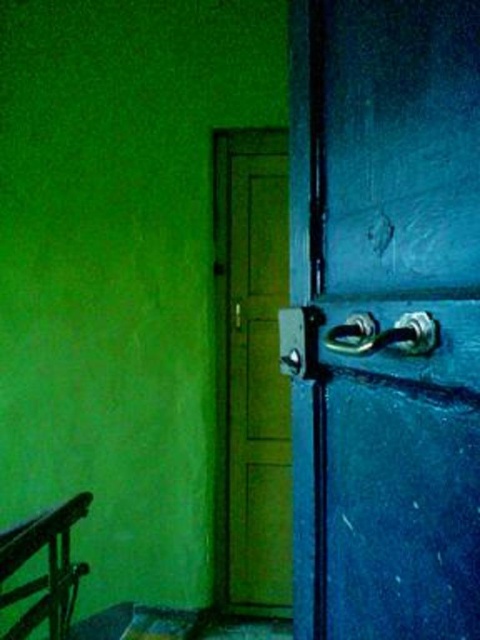
You are an interior designer assessing the door and balustrade. Which object has a greater width between the blue matte door handle at center and the brushed metal balustrade at lower left?

The blue matte door handle at center has a greater width than the brushed metal balustrade at lower left.

You are standing in a room with a green matte door at center. You want to open the door but need to know if you can reach it from your current position. The average person is about 5.5 feet tall. Can you reach the door handle if it is placed at the standard height of 42 inches?

The green matte door at center is 10.96 feet away from you, which is approximately 131.5 inches. Since the door handle is at 42 inches height, the distance from you to the door does not affect your ability to reach the handle. You can reach the handle as long as you can extend your arm to the door.

Consider the image. You are trying to open the green matte door at center but need to locate its handle. Based on the scene description, where would the polished metal door handle at center be in relation to the door?

The polished metal door handle at center is on the right side of the green matte door at center since the door handle is positioned to the right of the door.